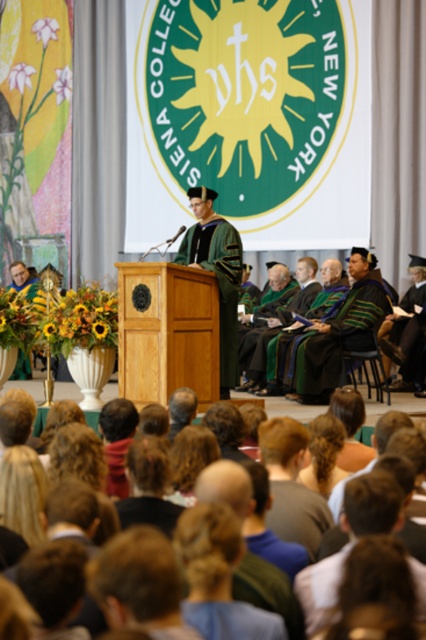
Question: Which object is closer to the camera taking this photo?

Choices:
 (A) dark brown hair at center
 (B) green velvet gown at center
 (C) green velvet robe at center

Answer: (A)

Question: Does dark brown hair at center appear on the left side of green velvet gown at center?

Choices:
 (A) no
 (B) yes

Answer: (B)

Question: Based on their relative distances, which object is nearer to the green velvet gown at center?

Choices:
 (A) dark brown hair at center
 (B) green velvet robe at center

Answer: (B)

Question: Can you confirm if dark brown hair at center is positioned above green velvet robe at center?

Choices:
 (A) yes
 (B) no

Answer: (B)

Question: Estimate the real-world distances between objects in this image. Which object is closer to the dark brown hair at center?

Choices:
 (A) green velvet robe at center
 (B) green velvet gown at center

Answer: (B)

Question: Where is dark brown hair at center located in relation to green velvet gown at center in the image?

Choices:
 (A) below
 (B) above

Answer: (A)